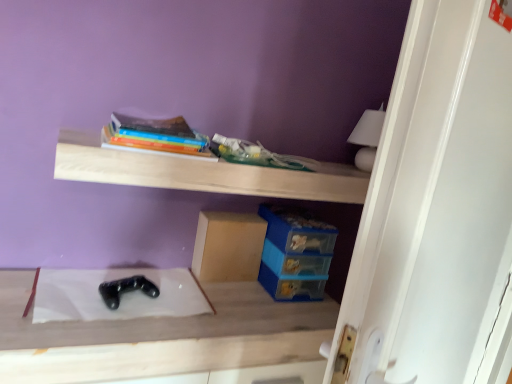
Where is `free spot above black matte game controller at center (from a real-world perspective)`? This screenshot has height=384, width=512. free spot above black matte game controller at center (from a real-world perspective) is located at coordinates (179, 303).